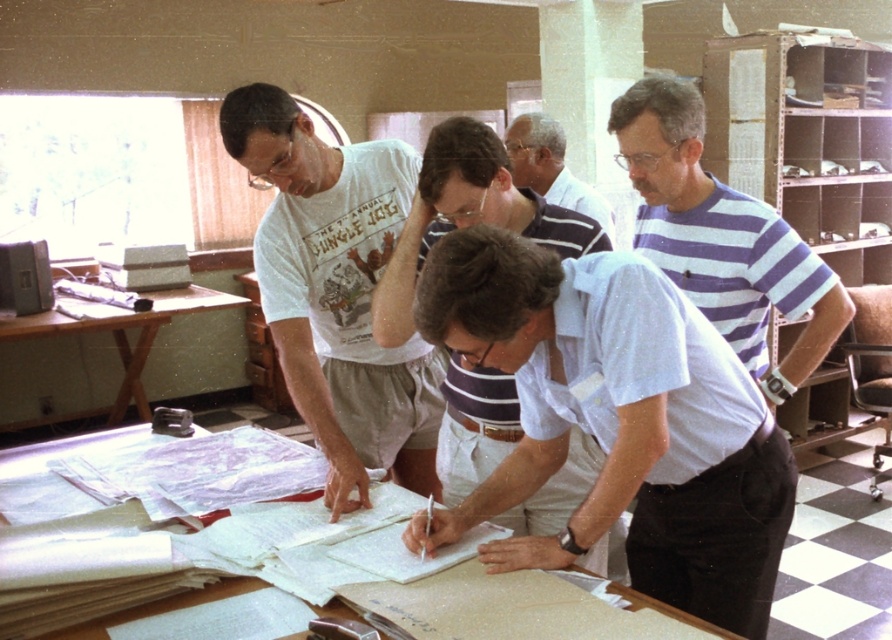
Question: Which point appears closest to the camera in this image?

Choices:
 (A) (793, 240)
 (B) (577, 449)

Answer: (B)

Question: Which point is closer to the camera?

Choices:
 (A) blue and white striped shirt at right
 (B) white paper at center
 (C) striped shirt at center

Answer: (B)

Question: Can you confirm if white cotton t-shirt at center is thinner than white paper at center?

Choices:
 (A) yes
 (B) no

Answer: (A)

Question: Can you confirm if white striped shirt at center is thinner than striped shirt at center?

Choices:
 (A) yes
 (B) no

Answer: (B)

Question: Does white striped shirt at center lie behind striped shirt at center?

Choices:
 (A) yes
 (B) no

Answer: (B)

Question: Among these objects, which one is nearest to the camera?

Choices:
 (A) white cotton t-shirt at center
 (B) white striped shirt at upper center
 (C) white paper at center
 (D) brown wooden table at left

Answer: (C)